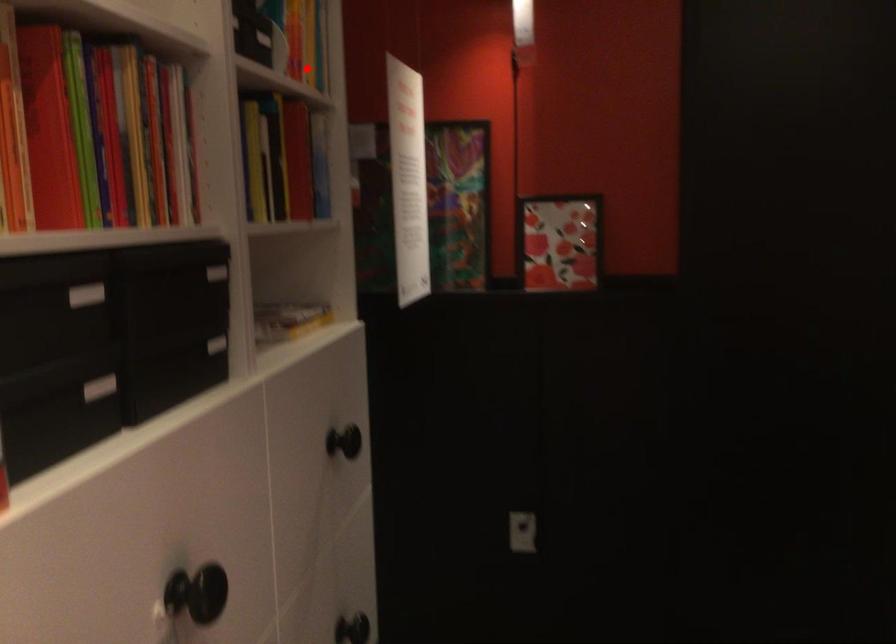
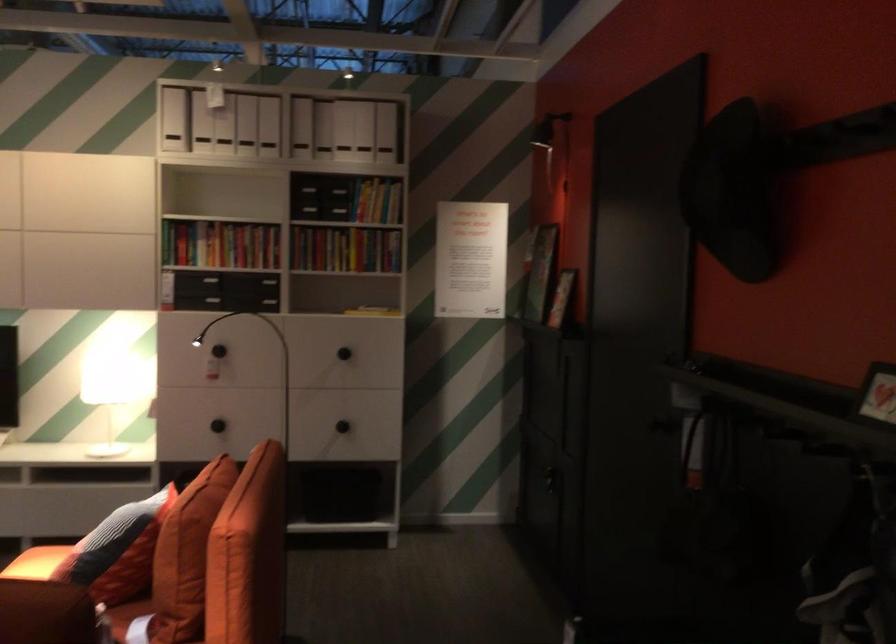
Question: I am providing you with two images of the same scene from different viewpoints. Given a red point in image1, look at the same physical point in image2. Is it:

Choices:
 (A) Closer to the viewpoint
 (B) Farther from the viewpoint

Answer: (B)